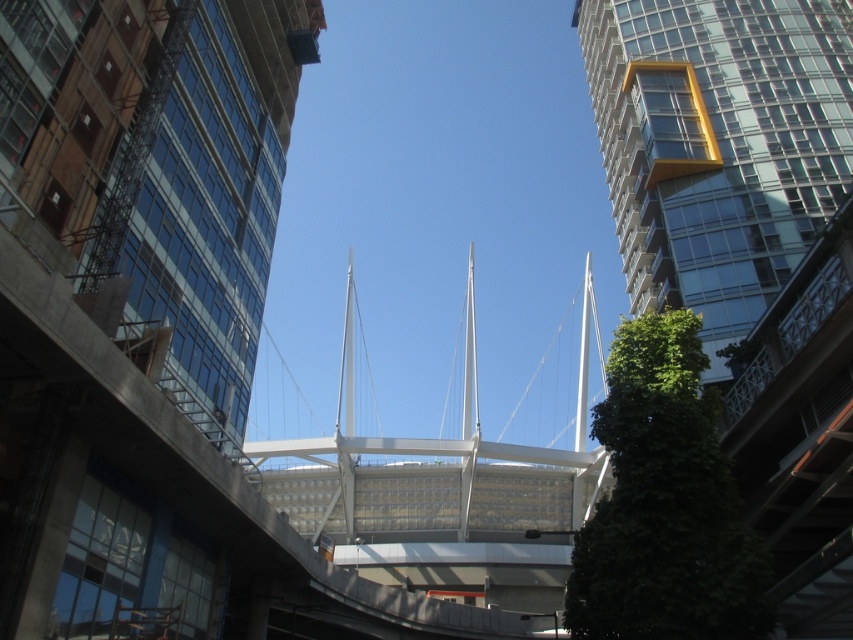
Question: Which point appears farthest from the camera in this image?

Choices:
 (A) (717, 259)
 (B) (71, 548)

Answer: (A)

Question: Which point is farther to the camera?

Choices:
 (A) clear glass building at upper left
 (B) transparent glass tower at right

Answer: (B)

Question: Which point appears farthest from the camera in this image?

Choices:
 (A) (637, 230)
 (B) (137, 369)

Answer: (A)

Question: Is clear glass building at upper left closer to camera compared to transparent glass tower at right?

Choices:
 (A) yes
 (B) no

Answer: (A)

Question: Considering the relative positions of clear glass building at upper left and transparent glass tower at right in the image provided, where is clear glass building at upper left located with respect to transparent glass tower at right?

Choices:
 (A) above
 (B) below

Answer: (B)

Question: Does clear glass building at upper left lie in front of transparent glass tower at right?

Choices:
 (A) yes
 (B) no

Answer: (A)